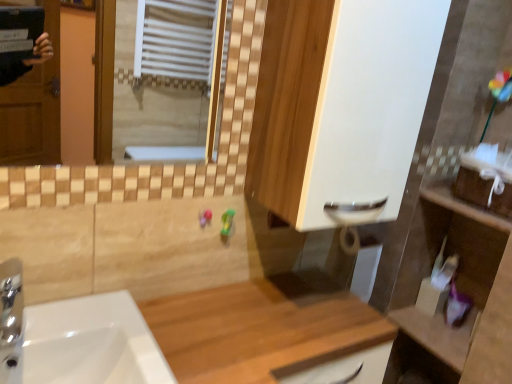
Question: Considering their positions, is wooden shelf at right located in front of or behind wooden at center?

Choices:
 (A) behind
 (B) front

Answer: (A)

Question: Looking at the image, does wooden shelf at right seem bigger or smaller compared to wooden at center?

Choices:
 (A) small
 (B) big

Answer: (A)

Question: Estimate the real-world distances between objects in this image. Which object is farther from the chrome metallic tap at lower left?

Choices:
 (A) white matte cabinet at center
 (B) wooden at center
 (C) white glossy sink at lower left
 (D) wooden shelf at right

Answer: (D)

Question: Which is farther from the chrome metallic tap at lower left?

Choices:
 (A) white matte cabinet at center
 (B) wooden at center
 (C) white glossy sink at lower left
 (D) wooden shelf at right

Answer: (D)